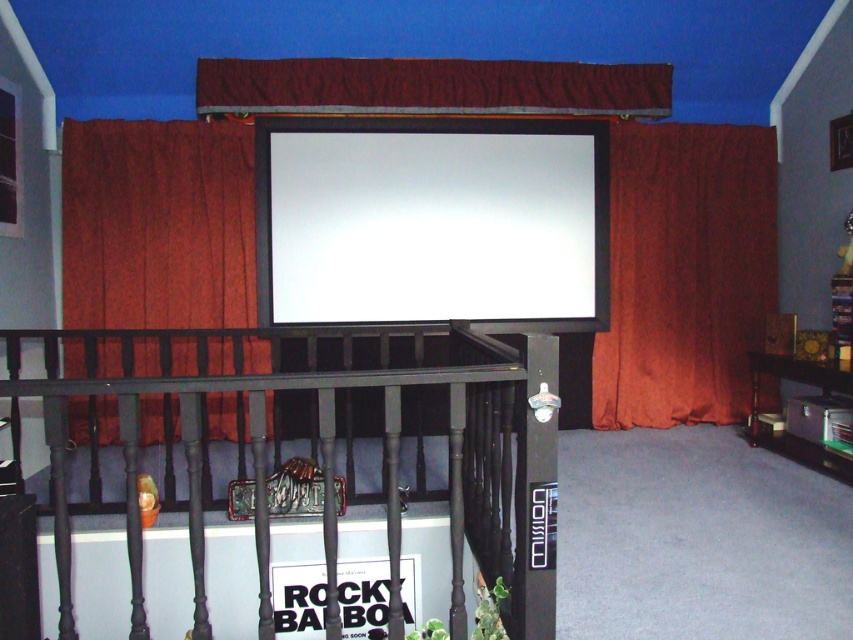
Who is positioned more to the left, white glossy projection screen at upper center or crimson velvet curtain at left?

Positioned to the left is crimson velvet curtain at left.

Does white glossy projection screen at upper center have a smaller size compared to crimson velvet curtain at left?

Indeed, white glossy projection screen at upper center has a smaller size compared to crimson velvet curtain at left.

This screenshot has height=640, width=853. Identify the location of white glossy projection screen at upper center. (432, 221).

Locate an element on the screen. This screenshot has width=853, height=640. white glossy projection screen at upper center is located at coordinates (432, 221).

Can you confirm if white glossy projection screen at upper center is smaller than black wrought iron balustrade at lower center?

Correct, white glossy projection screen at upper center occupies less space than black wrought iron balustrade at lower center.

Between white glossy projection screen at upper center and black wrought iron balustrade at lower center, which one is positioned lower?

black wrought iron balustrade at lower center is lower down.

Locate an element on the screen. The width and height of the screenshot is (853, 640). white glossy projection screen at upper center is located at coordinates point(432,221).

In order to click on white glossy projection screen at upper center in this screenshot , I will do `click(432, 221)`.

Which is more to the left, white glossy projection screen at upper center or burgundy velvet curtain at right?

white glossy projection screen at upper center

Is white glossy projection screen at upper center wider than burgundy velvet curtain at right?

Indeed, white glossy projection screen at upper center has a greater width compared to burgundy velvet curtain at right.

Between point (293, 124) and point (763, 125), which one is positioned behind?

The point (763, 125) is behind.

The height and width of the screenshot is (640, 853). Identify the location of white glossy projection screen at upper center. coord(432,221).